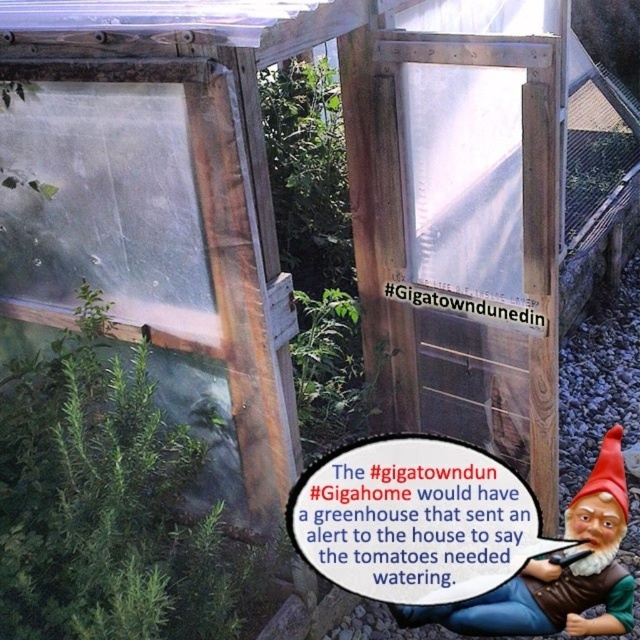
Question: Observing the image, what is the correct spatial positioning of green leafy plant at center in reference to red felt gnome hat at lower right?

Choices:
 (A) right
 (B) left

Answer: (B)

Question: Which is nearer to the green leafy plant at center?

Choices:
 (A) brown wooden gnome at lower right
 (B) red felt gnome hat at lower right

Answer: (A)

Question: Does brown wooden gnome at lower right appear over red felt gnome hat at lower right?

Choices:
 (A) no
 (B) yes

Answer: (A)

Question: Can you confirm if green leafy plant at center is thinner than brown wooden gnome at lower right?

Choices:
 (A) yes
 (B) no

Answer: (B)

Question: Which point is closer to the camera?

Choices:
 (A) (417, 612)
 (B) (586, 483)
 (C) (147, 388)

Answer: (C)

Question: Which point is farther from the camera taking this photo?

Choices:
 (A) (72, 586)
 (B) (504, 625)

Answer: (B)